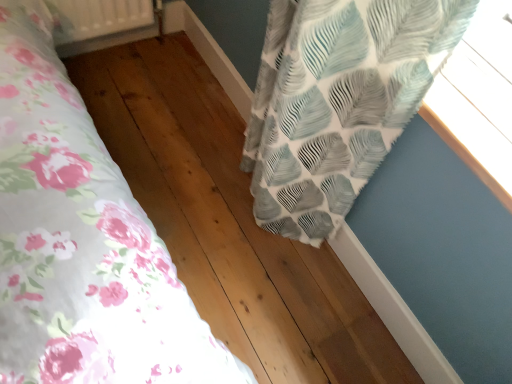
The image size is (512, 384). I want to click on vacant area that is in front of textured white and blue leaf-patterned curtain at upper right, so click(x=273, y=279).